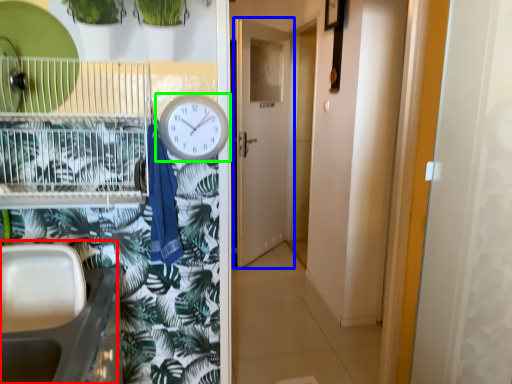
Question: Which is nearer to the sink (highlighted by a red box)? door (highlighted by a blue box) or clock (highlighted by a green box).

Choices:
 (A) door
 (B) clock

Answer: (B)